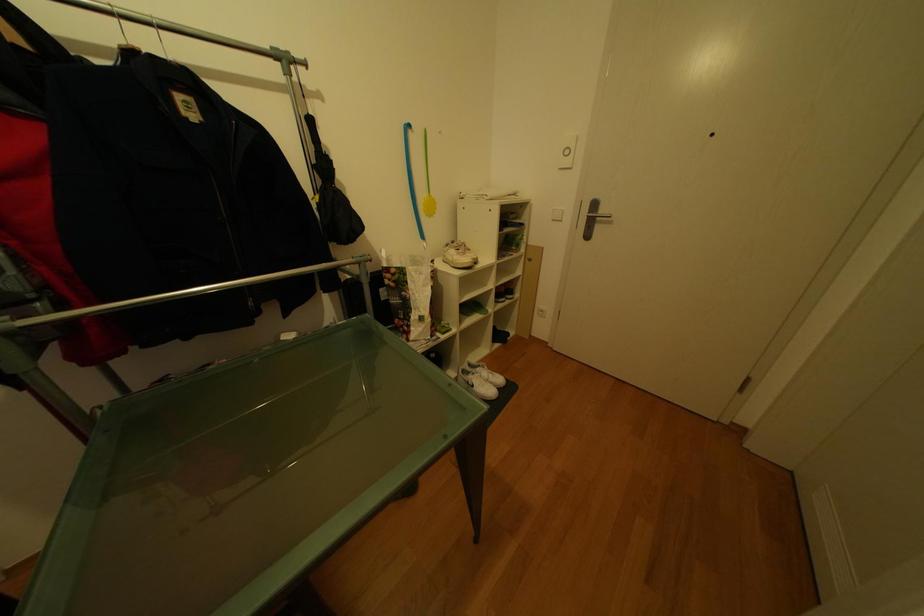
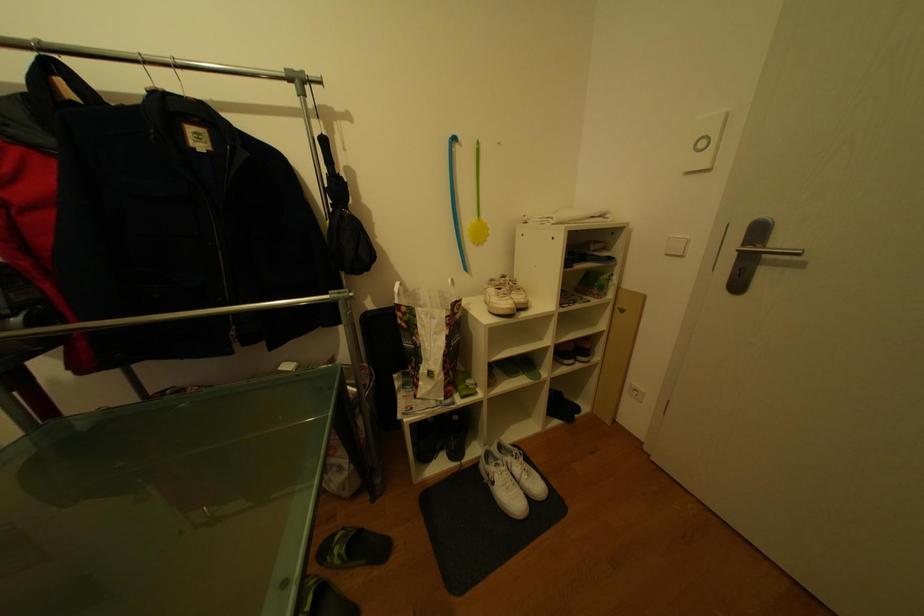
In the scene shown: Which direction would the cameraman need to move to produce the second image?

The cameraman walked toward right, forward.